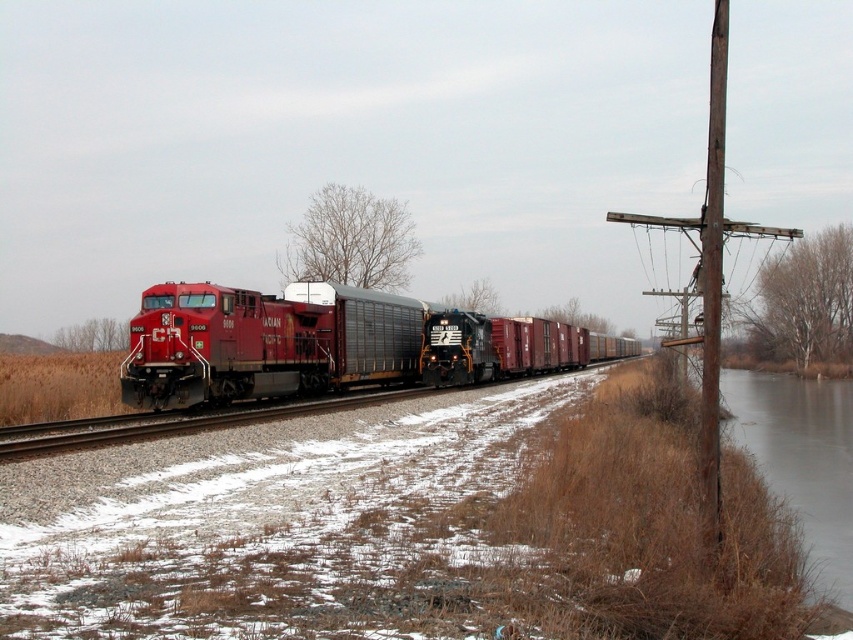
You are a passenger on the freight train and looking out the window. You see a brown wooden telegraph pole at right and a brown wooden pole at right. Which pole is closer to the train?

The brown wooden telegraph pole at right is closer to the train because it is to the left of the brown wooden pole at right, meaning it is positioned in front of the other pole from the train perspective.

You are standing at the center of the railway track and notice the brown wooden telegraph pole at right. Based on its position relative to your location, in which direction should you look to see the pole?

The brown wooden telegraph pole at right is located at point [711,273], which means it is positioned to the right and slightly ahead of your current position. Therefore, you should look to your right and forward to see the pole.